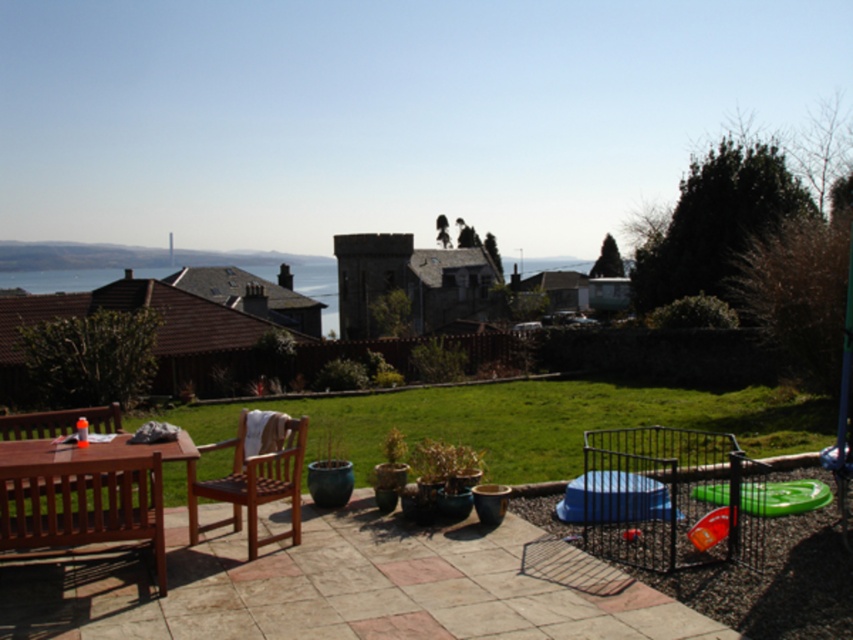
You are sitting on the wooden chair at center and want to place a book on the wooden table at lower left. Can you reach the table without moving from your seat?

The wooden table at lower left is in front of the wooden chair at center, so you can easily reach it from your current position.

Looking at this image, you are planning to place a new rectangular bench that is 1.2 meters wide in the backyard. You want to place it either where the wooden table at lower left or wooden chair at center currently is. Which location would allow the bench to fit without exceeding the space?

The wooden table at lower left has a greater width than the wooden chair at center. Since the bench is 1.2 meters wide, placing it where the wooden table at lower left is would provide enough space as the table is wider than the chair.

You are planning to set up a small garden in your backyard and need to place a 1.2 meter tall garden statue. You see the wooden table at lower left and the wooden chair at center. Which object is shorter and therefore suitable for placing the statue next to without blocking the view?

The wooden table at lower left is not as tall as the wooden chair at center, so placing the 1.2 meter tall garden statue next to the wooden table at lower left would be better to avoid blocking the view.